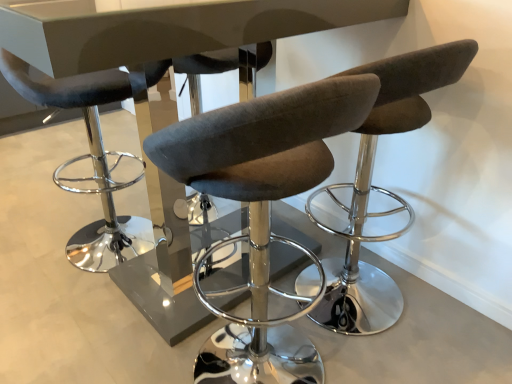
Question: Is glossy white table at center taller or shorter than matte black stool at left, acting as the second chair starting from the right?

Choices:
 (A) short
 (B) tall

Answer: (B)

Question: Visually, is glossy white table at center positioned to the left or to the right of matte black stool at left, acting as the second chair starting from the right?

Choices:
 (A) right
 (B) left

Answer: (A)

Question: Which of these objects is positioned farthest from the glossy white table at center?

Choices:
 (A) brown fabric stool at center, which appears as the 2th chair when viewed from the left
 (B) matte black stool at left, marked as the first chair in a left-to-right arrangement

Answer: (B)

Question: Which object is positioned closest to the brown fabric stool at center, the first chair in the right-to-left sequence?

Choices:
 (A) glossy white table at center
 (B) matte black stool at left, marked as the first chair in a left-to-right arrangement

Answer: (A)